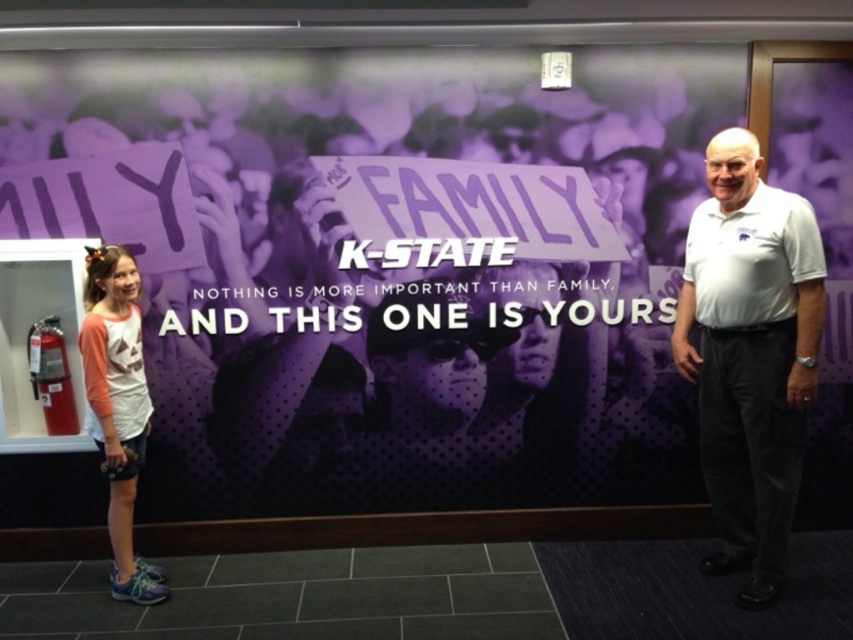
You are taking a photo of the purple matte banner at center and the white cotton polo shirt at right. Which object should you focus on first to ensure both are in clear view?

The purple matte banner at center is closer to you than the white cotton polo shirt at right, so you should focus on the purple matte banner at center first to ensure both are in clear view.

You are a photographer trying to capture both the purple matte banner at center and the matte pink shirt at left in the same frame. Based on their positions, which object should you focus on first to ensure both are in the frame?

The purple matte banner at center is to the right of the matte pink shirt at left, so you should focus on the matte pink shirt at left first to ensure both are in the frame.